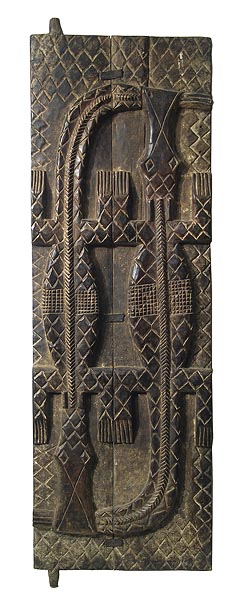
This screenshot has height=600, width=241. Find the location of `hook`. hook is located at coordinates (55, 27).